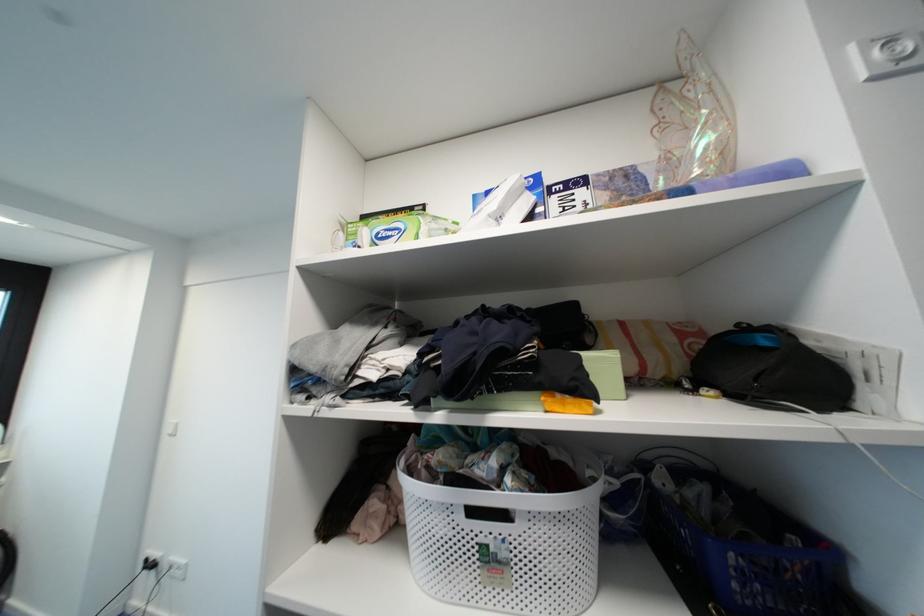
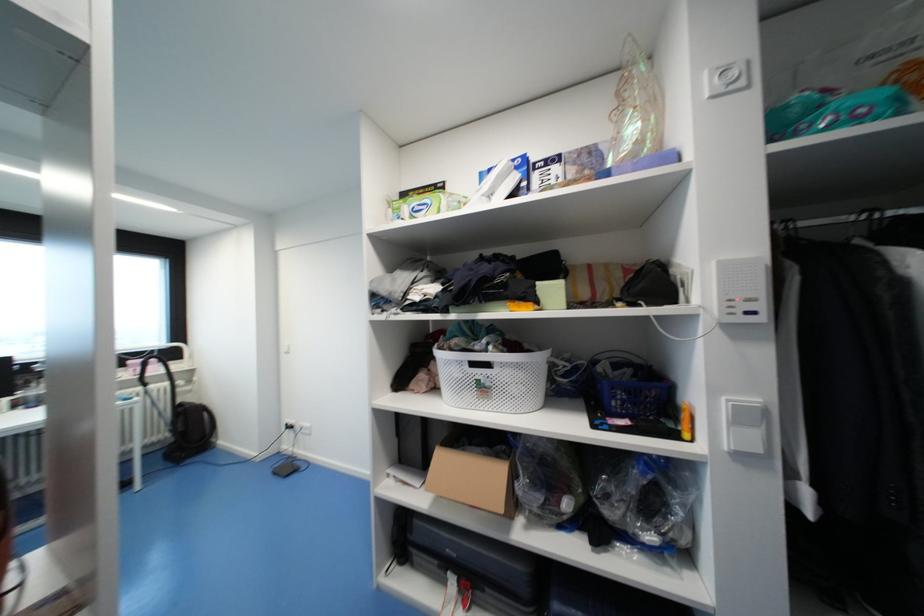
In the second image, find the point that corresponds to pixel 684 477 in the first image.

(621, 367)